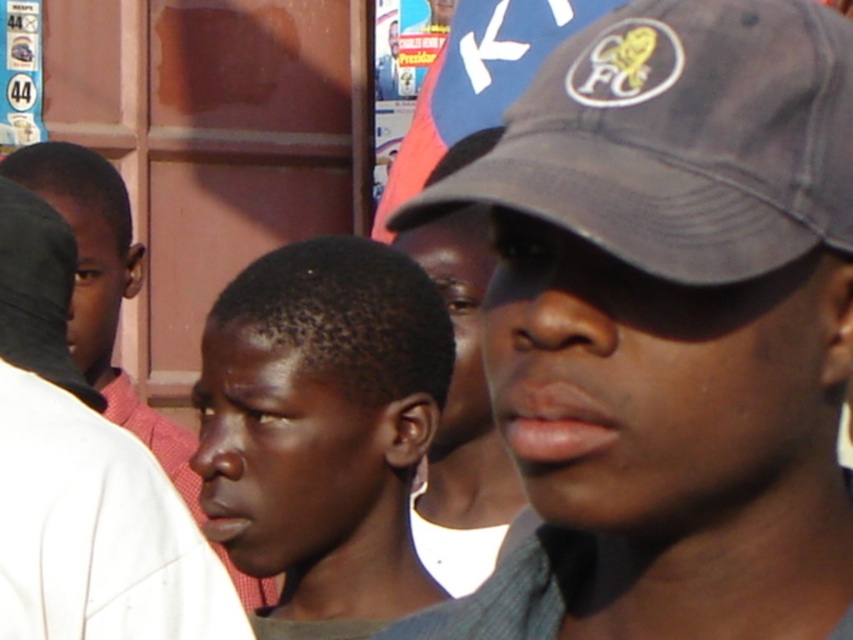
You are a photographer trying to capture a clear shot of both the dark gray fabric baseball cap at upper right and the matte black cap at upper right. Which cap should you focus on first to ensure both are in focus?

You should focus on the dark gray fabric baseball cap at upper right first because it is closer to the viewer than the matte black cap at upper right. By focusing on the closer object, the farther one will also be in focus due to the depth of field.

You are a photographer trying to capture a clear shot of both the dark gray cap at center and the black matte cap at left. Since you can only focus on one subject at a time, which cap should you prioritize focusing on to ensure it appears sharp in the photo?

The dark gray cap at center should be prioritized for sharp focus because it is in front of the black matte cap at left, making it closer to the camera and thus easier to capture clearly.

You are a photographer trying to capture a clear shot of both the dark gray cap at center and the dark gray fabric baseball cap at upper right. Which cap should you focus on first if you want to ensure both are in frame and properly aligned?

The dark gray fabric baseball cap at upper right should be focused on first because the dark gray cap at center is positioned to its right, so adjusting the frame to include the cap on the left ensures both are captured.